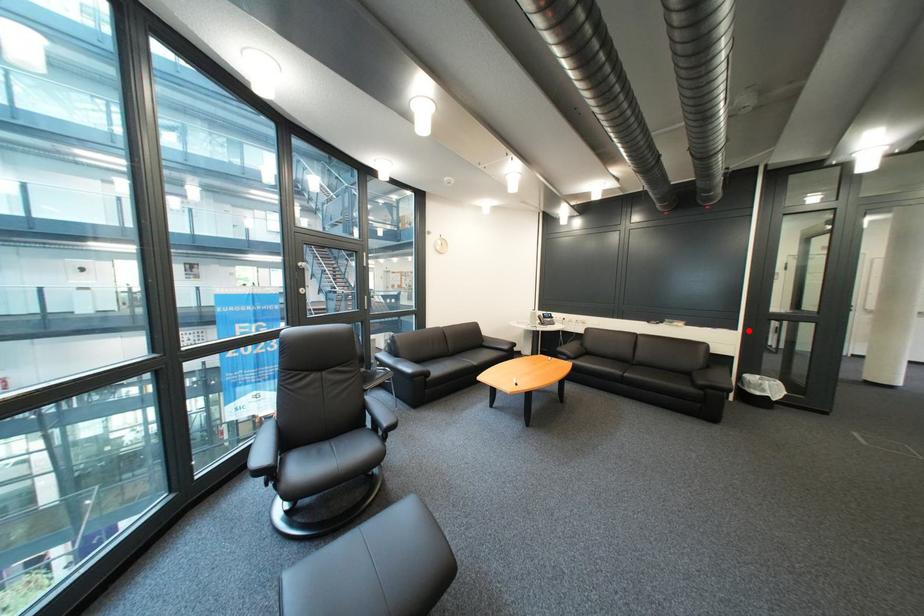
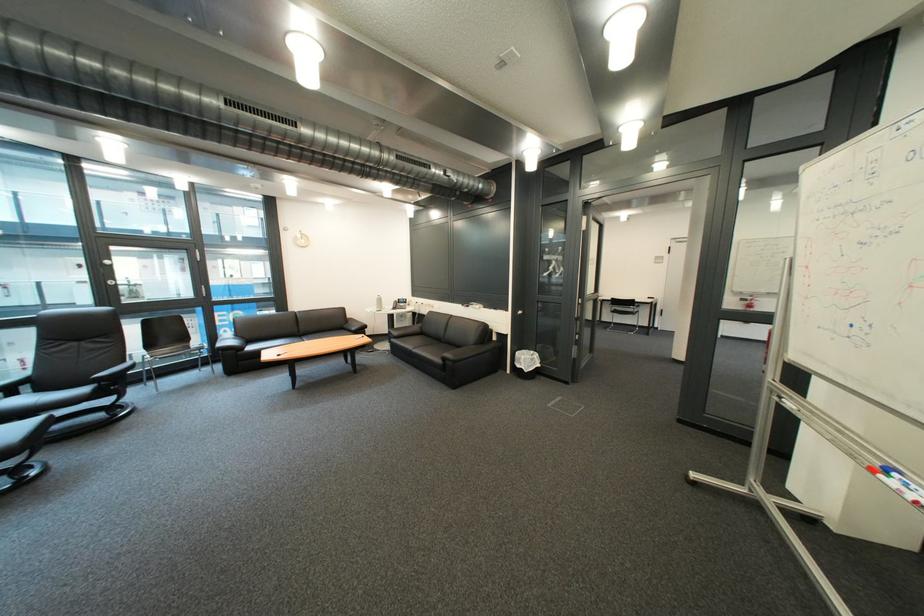
Locate, in the second image, the point that corresponds to the highlighted location in the first image.

(520, 312)